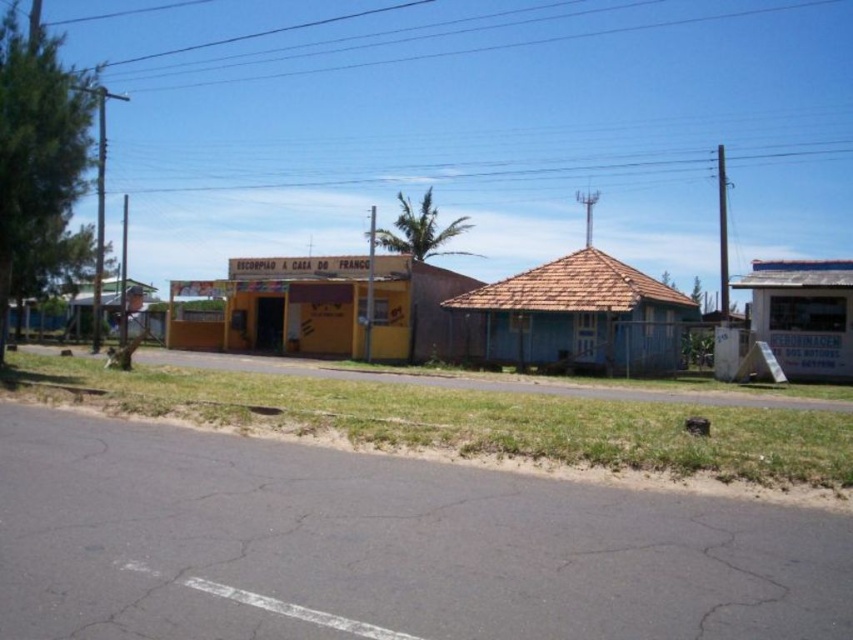
Question: Can you confirm if yellow painted wood hut at center is positioned to the right of white corrugated metal hut at right?

Choices:
 (A) no
 (B) yes

Answer: (A)

Question: Considering the real-world distances, which object is farthest from the blue wooden hut at center?

Choices:
 (A) white corrugated metal hut at right
 (B) yellow painted wood hut at center
 (C) wooden hut at left

Answer: (C)

Question: Which point is closer to the camera?

Choices:
 (A) (115, 316)
 (B) (293, 342)
 (C) (799, 304)
 (D) (520, 273)

Answer: (C)

Question: Is white corrugated metal hut at right positioned before wooden hut at left?

Choices:
 (A) yes
 (B) no

Answer: (A)

Question: Which object is positioned farthest from the white corrugated metal hut at right?

Choices:
 (A) blue wooden hut at center
 (B) yellow painted wood hut at center
 (C) wooden hut at left

Answer: (C)

Question: Is blue wooden hut at center bigger than white corrugated metal hut at right?

Choices:
 (A) yes
 (B) no

Answer: (B)